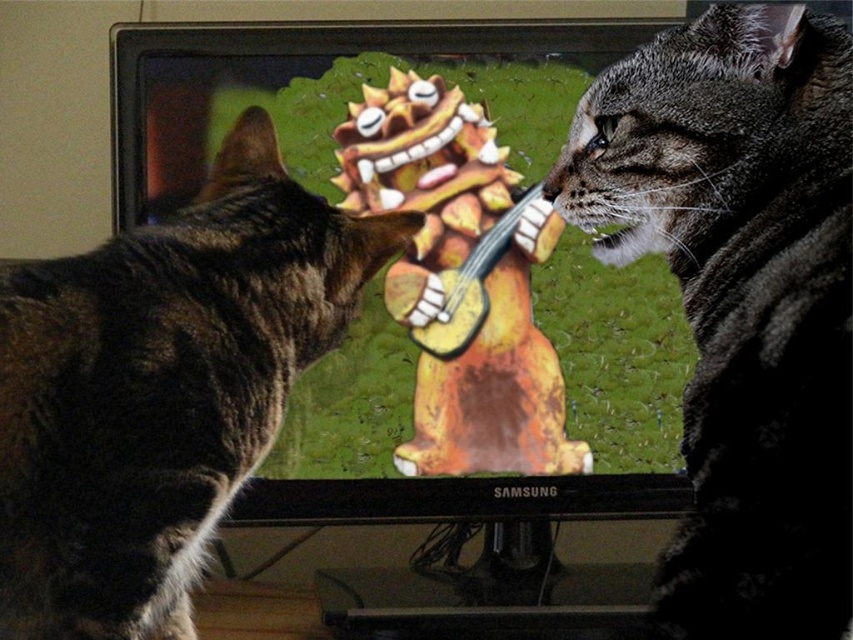
Is tabby fur cat at right below tabby fur cat at left?

No.

Describe the element at coordinates (740, 298) in the screenshot. I see `tabby fur cat at right` at that location.

Who is more distant from viewer, [815,500] or [166,291]?

The point [166,291] is more distant.

Locate an element on the screen. Image resolution: width=853 pixels, height=640 pixels. tabby fur cat at right is located at coordinates (740, 298).

Does point (51, 284) come farther from viewer compared to point (444, 316)?

That is False.

Does point (61, 381) come behind point (437, 129)?

No, (61, 381) is closer to viewer.

Locate an element on the screen. tabby fur cat at left is located at coordinates (161, 388).

Is tabby fur cat at right to the left of wooden guitar at center from the viewer's perspective?

In fact, tabby fur cat at right is to the right of wooden guitar at center.

Is point (795, 20) in front of point (482, 355)?

Yes, it is.

This screenshot has height=640, width=853. In order to click on tabby fur cat at right in this screenshot , I will do `click(740, 298)`.